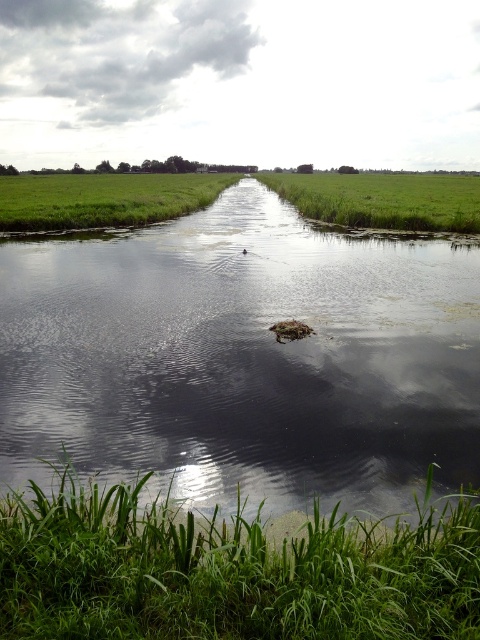
Question: Considering the real-world distances, which object is closest to the green leafy grass at center?

Choices:
 (A) green grass at center
 (B) clear water at center
 (C) green grass at upper right
 (D) green grass at left

Answer: (B)

Question: Which object is closer to the camera taking this photo?

Choices:
 (A) green grass at upper right
 (B) green leafy grass at center
 (C) clear water at center

Answer: (B)

Question: Which point is farther from the camera taking this photo?

Choices:
 (A) (122, 410)
 (B) (416, 189)

Answer: (B)

Question: Does green grass at center lie in front of green grass at left?

Choices:
 (A) yes
 (B) no

Answer: (A)

Question: From the image, what is the correct spatial relationship of green leafy grass at center in relation to green grass at upper right?

Choices:
 (A) right
 (B) left

Answer: (B)

Question: Is green grass at center further to camera compared to green grass at upper right?

Choices:
 (A) no
 (B) yes

Answer: (B)